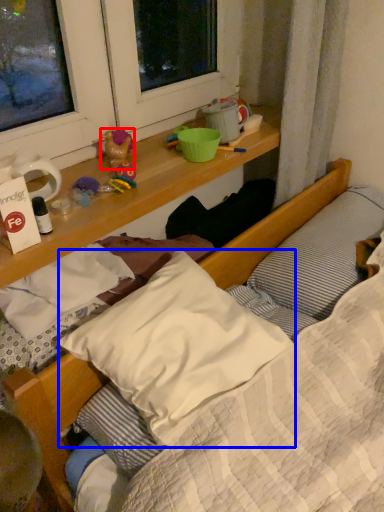
Question: Which point is closer to the camera, toy (highlighted by a red box) or pillow (highlighted by a blue box)?

Choices:
 (A) toy
 (B) pillow

Answer: (B)